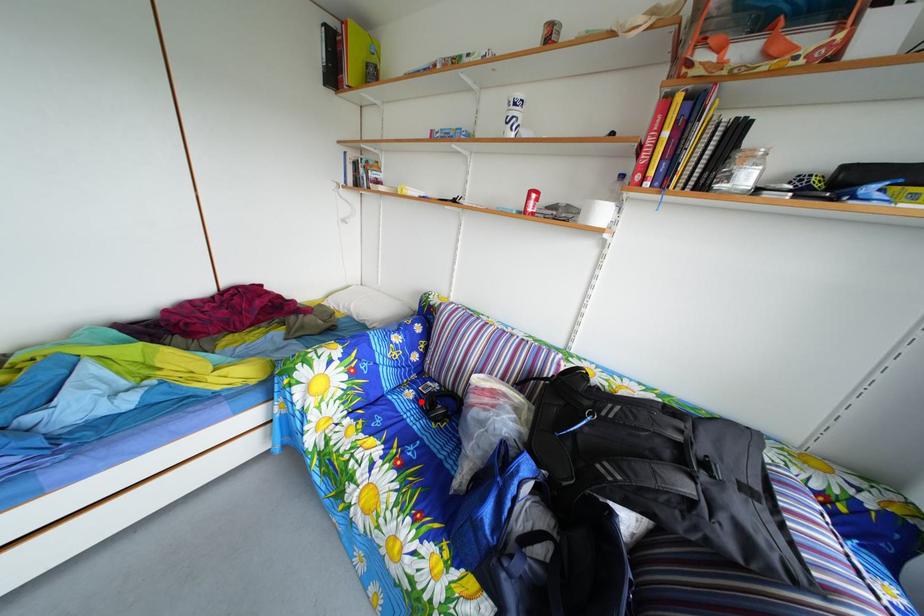
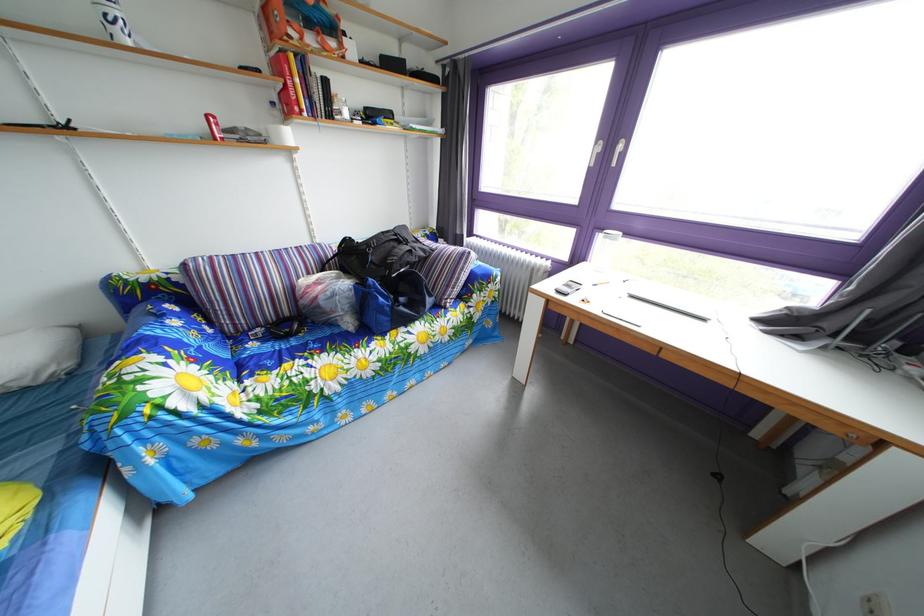
Locate, in the second image, the point that corresponds to the highlighted location in the first image.

(262, 353)